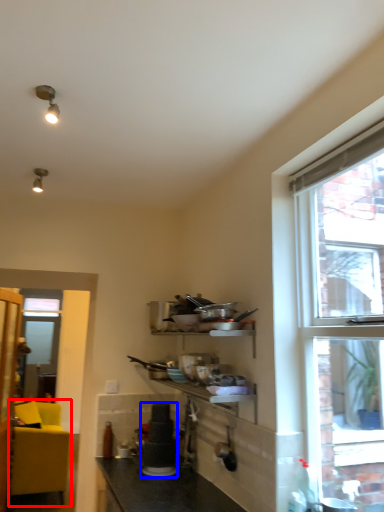
Question: Which object is closer to the camera taking this photo, studio couch (highlighted by a red box) or appliance (highlighted by a blue box)?

Choices:
 (A) studio couch
 (B) appliance

Answer: (B)